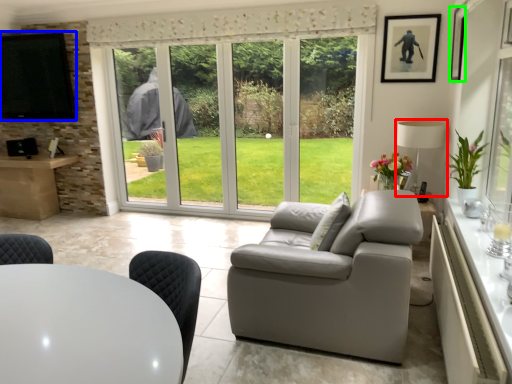
Question: Which object is the closest to the lamp (highlighted by a red box)? Choose among these: window screen (highlighted by a blue box) or picture frame (highlighted by a green box).

Choices:
 (A) window screen
 (B) picture frame

Answer: (B)